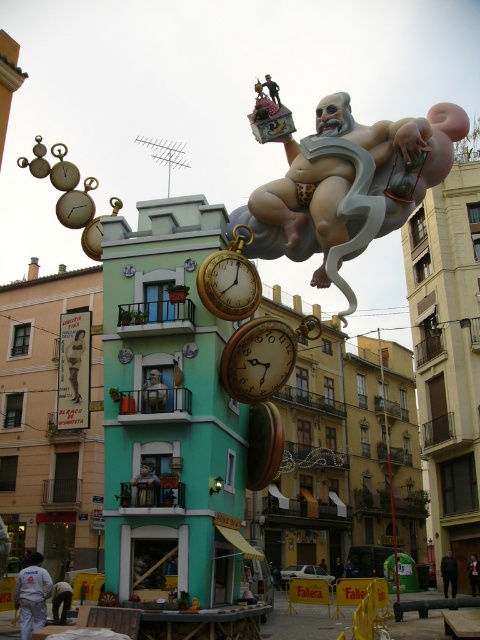
Question: Which object is the closest to the gold metallic clock at center?

Choices:
 (A) gold metallic pocket watch at center
 (B) matte gold statue at center

Answer: (A)

Question: In this image, where is matte gold statue at center located relative to gold metallic clock at center?

Choices:
 (A) right
 (B) left

Answer: (A)

Question: Is gold metallic clock at center wider than gold metallic pocket watch at center?

Choices:
 (A) yes
 (B) no

Answer: (A)

Question: Which point is closer to the camera taking this photo?

Choices:
 (A) (375, 160)
 (B) (227, 294)

Answer: (B)

Question: Does matte gold statue at center appear over gold metallic clock at center?

Choices:
 (A) no
 (B) yes

Answer: (B)

Question: Considering the real-world distances, which object is farthest from the gold metallic pocket watch at center?

Choices:
 (A) matte gold statue at center
 (B) gold metallic clock at center

Answer: (A)